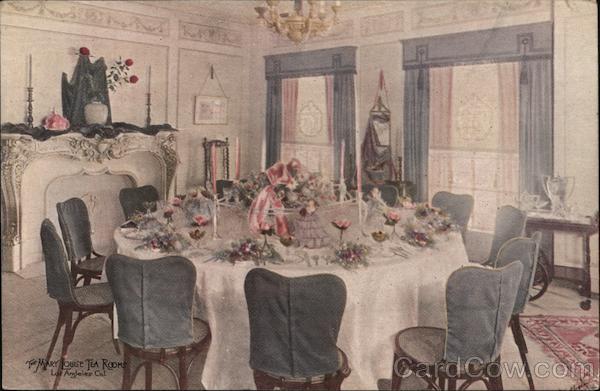
This screenshot has height=391, width=600. I want to click on rug, so click(x=565, y=329).